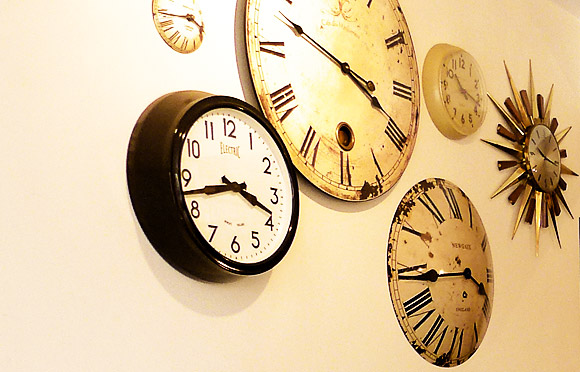
Where is `clock faces`? clock faces is located at coordinates (551, 162), (455, 90), (431, 297), (351, 47), (231, 198), (166, 19).